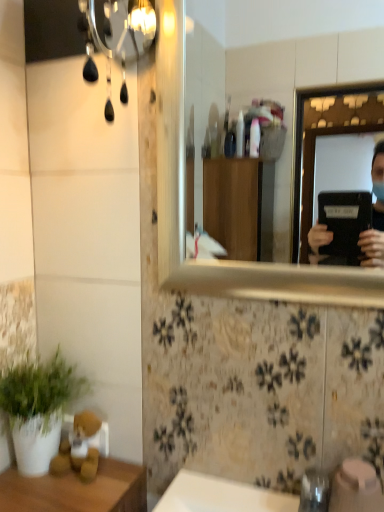
You are a GUI agent. You are given a task and a screenshot of the screen. Output one action in this format:
    pyautogui.click(x=<x>, y=<y>)
    Task: Click on the metallic silver mirror at upper right
    This screenshot has height=512, width=384.
    Given the screenshot: What is the action you would take?
    pyautogui.click(x=278, y=67)

Image resolution: width=384 pixels, height=512 pixels. What do you see at coordinates (278, 67) in the screenshot?
I see `metallic silver mirror at upper right` at bounding box center [278, 67].

In order to face white matte plant at lower left, should I rotate leftwards or rightwards?

Turn left by 19.592 degrees to look at white matte plant at lower left.

What do you see at coordinates (38, 409) in the screenshot? I see `white matte plant at lower left` at bounding box center [38, 409].

This screenshot has width=384, height=512. I want to click on white matte plant at lower left, so point(38,409).

Where is `metallic silver mirror at upper right`? This screenshot has width=384, height=512. metallic silver mirror at upper right is located at coordinates (278, 67).

Looking at this image, is white matte plant at lower left at the left side of metallic silver mirror at upper right?

Yes, white matte plant at lower left is to the left of metallic silver mirror at upper right.

Considering their positions, is white matte plant at lower left located in front of or behind metallic silver mirror at upper right?

white matte plant at lower left is positioned farther from the viewer than metallic silver mirror at upper right.

Considering the points (36, 396) and (272, 39), which point is in front, point (36, 396) or point (272, 39)?

The point (36, 396) is closer to the camera.

From the image's perspective, which one is positioned higher, white matte plant at lower left or metallic silver mirror at upper right?

From the image's view, metallic silver mirror at upper right is above.

From a real-world perspective, which object rests below the other?

white matte plant at lower left is physically lower.

Between white matte plant at lower left and metallic silver mirror at upper right, which one has smaller width?

metallic silver mirror at upper right.

Is white matte plant at lower left taller than metallic silver mirror at upper right?

No.

Which of these two, white matte plant at lower left or metallic silver mirror at upper right, is bigger?

Bigger between the two is metallic silver mirror at upper right.

Would you say white matte plant at lower left is outside metallic silver mirror at upper right?

Indeed, white matte plant at lower left is completely outside metallic silver mirror at upper right.

Is white matte plant at lower left placed right next to metallic silver mirror at upper right?

No, white matte plant at lower left is not making contact with metallic silver mirror at upper right.

Could you tell me if white matte plant at lower left is facing metallic silver mirror at upper right?

No, white matte plant at lower left is not facing towards metallic silver mirror at upper right.

Locate an element on the screen. The height and width of the screenshot is (512, 384). houseplant lying on the left of metallic silver mirror at upper right is located at coordinates (38, 409).

Is metallic silver mirror at upper right to the left or to the right of white matte plant at lower left in the image?

From the image, it's evident that metallic silver mirror at upper right is to the right of white matte plant at lower left.

Which is behind, metallic silver mirror at upper right or white matte plant at lower left?

white matte plant at lower left.

Is point (263, 73) closer to camera compared to point (11, 384)?

No, it is not.

From the image's perspective, which one is positioned higher, metallic silver mirror at upper right or white matte plant at lower left?

metallic silver mirror at upper right appears higher in the image.

From a real-world perspective, is metallic silver mirror at upper right physically located above or below white matte plant at lower left?

metallic silver mirror at upper right is above white matte plant at lower left.

Considering the sizes of objects metallic silver mirror at upper right and white matte plant at lower left in the image provided, who is thinner, metallic silver mirror at upper right or white matte plant at lower left?

metallic silver mirror at upper right is thinner.

From their relative heights in the image, would you say metallic silver mirror at upper right is taller or shorter than white matte plant at lower left?

metallic silver mirror at upper right is taller than white matte plant at lower left.

Considering the sizes of objects metallic silver mirror at upper right and white matte plant at lower left in the image provided, who is smaller, metallic silver mirror at upper right or white matte plant at lower left?

white matte plant at lower left.

Is white matte plant at lower left inside metallic silver mirror at upper right?

That's incorrect, white matte plant at lower left is not inside metallic silver mirror at upper right.

Consider the image. Is metallic silver mirror at upper right not close to white matte plant at lower left?

Yes.

Could you tell me if metallic silver mirror at upper right is facing white matte plant at lower left?

No, metallic silver mirror at upper right does not turn towards white matte plant at lower left.

In the scene shown: How many degrees apart are the facing directions of metallic silver mirror at upper right and white matte plant at lower left?

0.456 degrees.

Measure the distance from metallic silver mirror at upper right to white matte plant at lower left.

The distance of metallic silver mirror at upper right from white matte plant at lower left is 5.54 feet.

Find the location of a particular element. This screenshot has height=512, width=384. mirror positioned vertically above the white matte plant at lower left (from a real-world perspective) is located at coordinates (278, 67).

Where is `houseplant that is on the left side of metallic silver mirror at upper right`? houseplant that is on the left side of metallic silver mirror at upper right is located at coordinates (38, 409).

Image resolution: width=384 pixels, height=512 pixels. I want to click on houseplant behind the metallic silver mirror at upper right, so click(x=38, y=409).